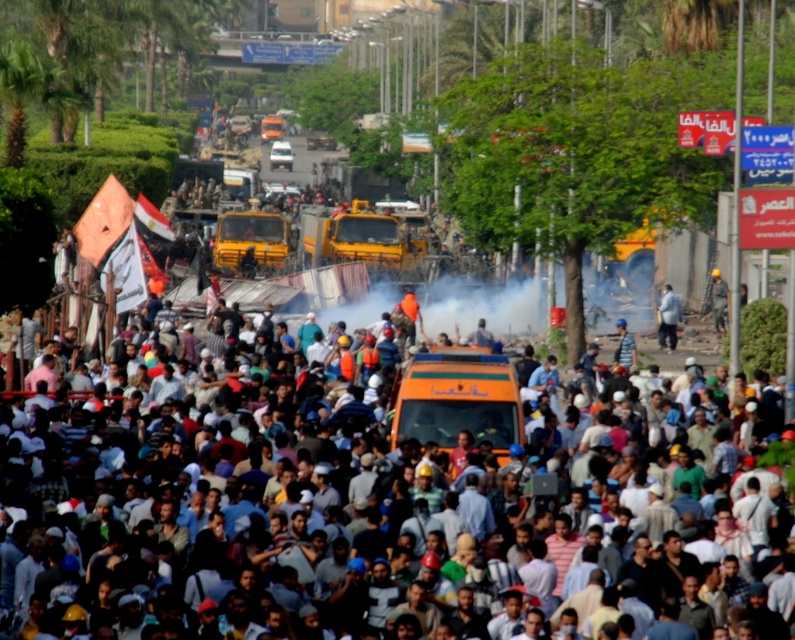
Question: Is orange fabric crowd at center below light blue fabric shirt at center?

Choices:
 (A) yes
 (B) no

Answer: (A)

Question: Does light blue fabric shirt at center appear on the left side of yellow hard hat at center?

Choices:
 (A) no
 (B) yes

Answer: (B)

Question: Which is nearer to the orange fabric crowd at center?

Choices:
 (A) yellow hard hat at center
 (B) white dusty smoke at center

Answer: (B)

Question: Among these points, which one is nearest to the camera?

Choices:
 (A) (673, 316)
 (B) (111, 460)

Answer: (B)

Question: Estimate the real-world distances between objects in this image. Which object is closer to the white dusty smoke at center?

Choices:
 (A) light blue fabric shirt at center
 (B) yellow hard hat at center
 (C) orange fabric crowd at center

Answer: (A)

Question: Is light blue fabric shirt at center thinner than yellow hard hat at center?

Choices:
 (A) no
 (B) yes

Answer: (A)